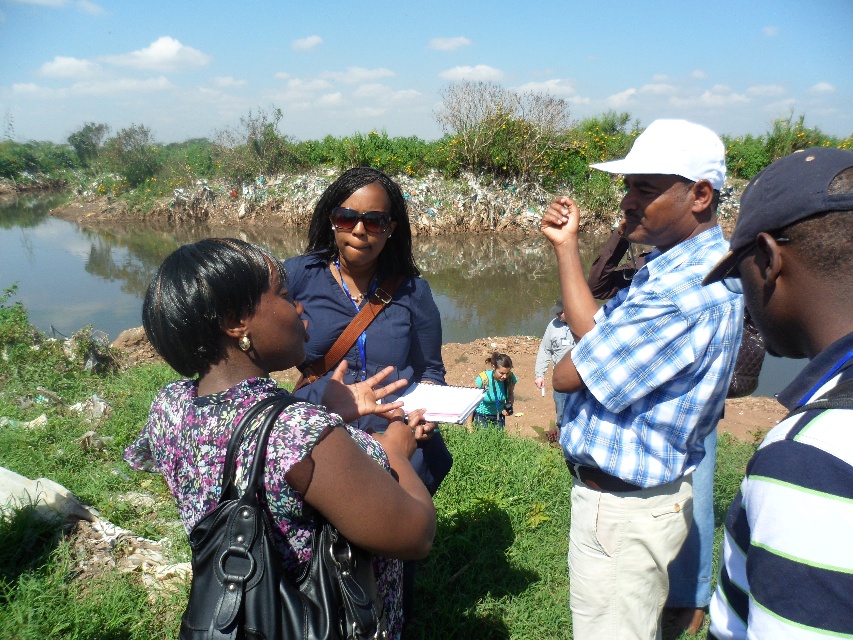
Question: Among these objects, which one is farthest from the camera?

Choices:
 (A) blue plaid shirt at center
 (B) floral fabric blouse at center

Answer: (A)

Question: Can you confirm if blue plaid shirt at center is thinner than striped cotton shirt at right?

Choices:
 (A) no
 (B) yes

Answer: (B)

Question: Based on their relative distances, which object is farther from the striped cotton shirt at right?

Choices:
 (A) matte blue shirt at center
 (B) blue plaid shirt at center

Answer: (A)

Question: Which object appears farthest from the camera in this image?

Choices:
 (A) matte blue shirt at center
 (B) blue plaid shirt at center
 (C) floral fabric blouse at center

Answer: (B)

Question: Does blue plaid shirt at center have a greater width compared to floral fabric blouse at center?

Choices:
 (A) yes
 (B) no

Answer: (B)

Question: Where is floral fabric blouse at center located in relation to striped cotton shirt at right in the image?

Choices:
 (A) below
 (B) above

Answer: (A)